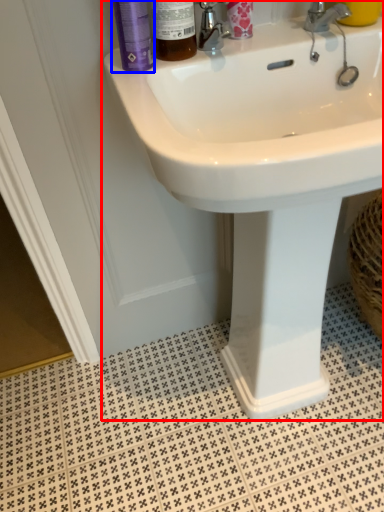
Question: Among these objects, which one is farthest to the camera, sink (highlighted by a red box) or mouthwash (highlighted by a blue box)?

Choices:
 (A) sink
 (B) mouthwash

Answer: (B)